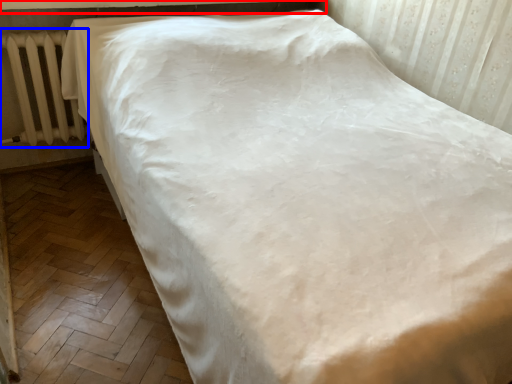
Question: Among these objects, which one is farthest to the camera, window sill (highlighted by a red box) or radiator (highlighted by a blue box)?

Choices:
 (A) window sill
 (B) radiator

Answer: (B)